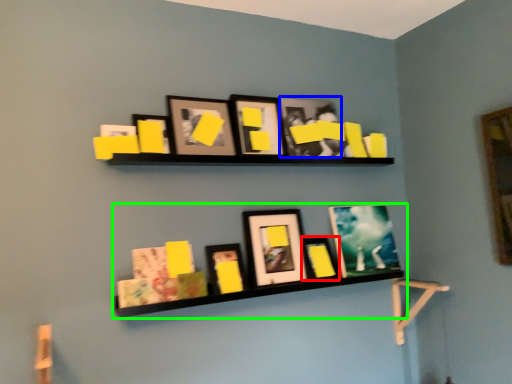
Question: Which is nearer to the picture frame (highlighted by a red box)? picture frame (highlighted by a blue box) or shelf (highlighted by a green box).

Choices:
 (A) picture frame
 (B) shelf

Answer: (B)